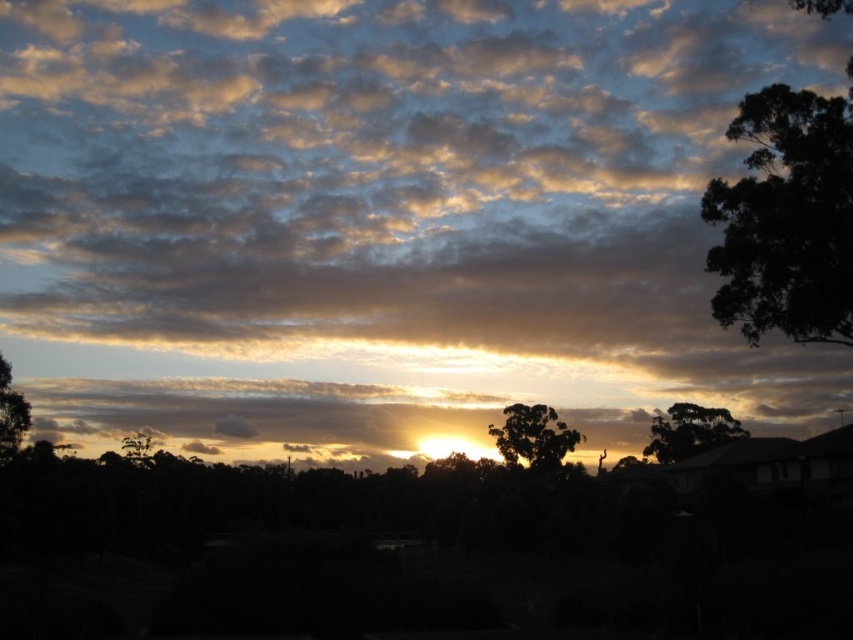
You are standing in the middle of the image looking towards the sunset. Which of the two trees, the green leafy tree at left or the green leafy tree at lower left, is positioned more to your right?

The green leafy tree at left is positioned more to the right compared to the green leafy tree at lower left.